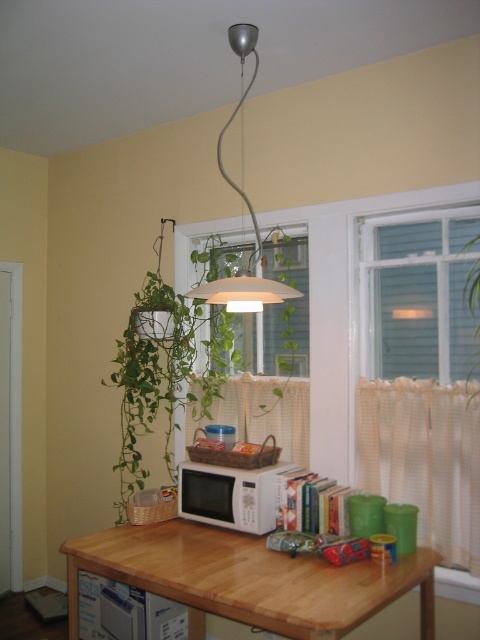
Can you confirm if white sheer curtain at lower right is wider than white matte microwave at center?

In fact, white sheer curtain at lower right might be narrower than white matte microwave at center.

Who is more distant from viewer, (x=363, y=429) or (x=249, y=484)?

The point (x=363, y=429) is behind.

Locate an element on the screen. white sheer curtain at lower right is located at coordinates (424, 458).

Does wooden table at center appear over transparent glass window at center?

No.

Does wooden table at center appear under transparent glass window at center?

Indeed, wooden table at center is positioned under transparent glass window at center.

The image size is (480, 640). What do you see at coordinates (248, 579) in the screenshot? I see `wooden table at center` at bounding box center [248, 579].

At what (x,y) coordinates should I click in order to perform the action: click on wooden table at center. Please return your answer as a coordinate pair (x, y). Looking at the image, I should click on (248, 579).

Between point (432, 436) and point (257, 442), which one is positioned in front?

Point (432, 436)

Identify the location of white sheer curtain at lower right. (424, 458).